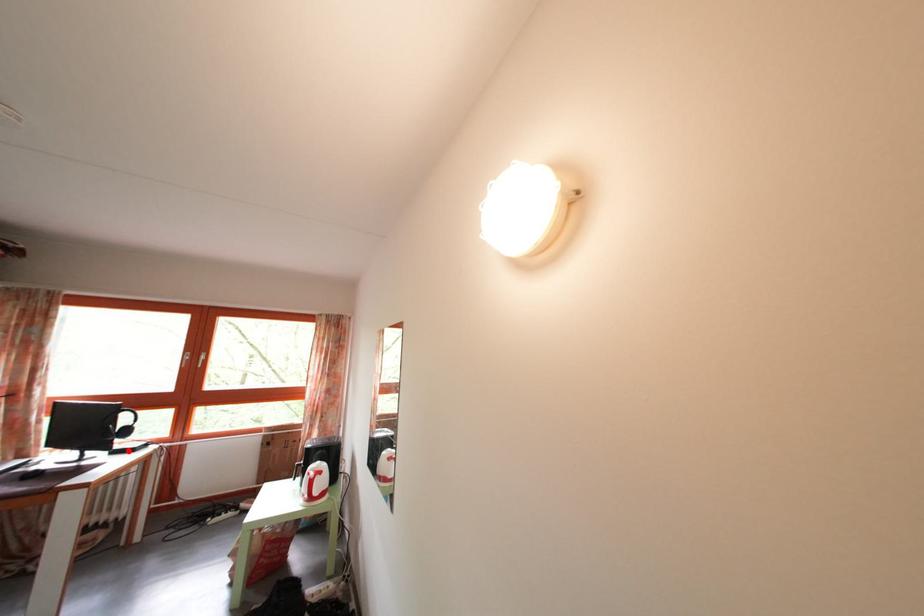
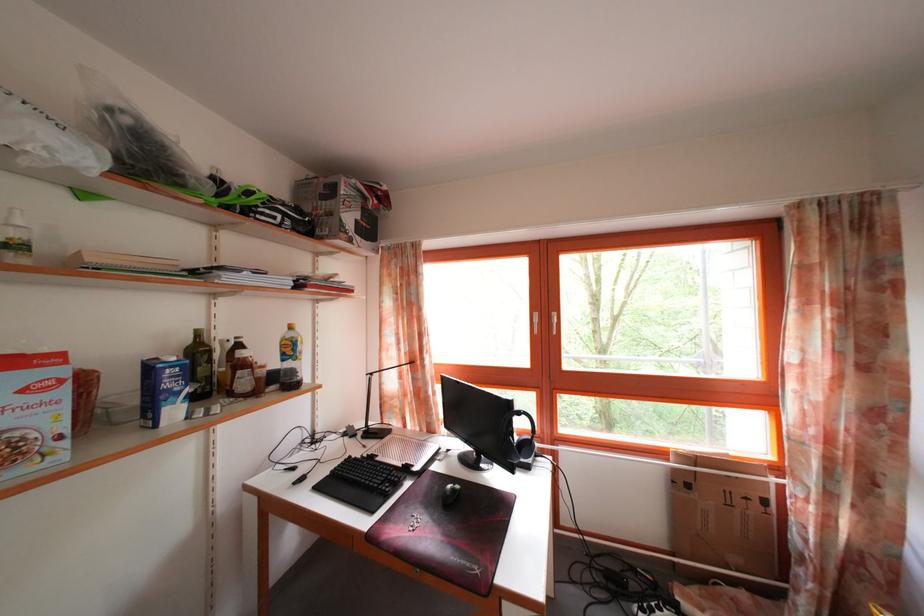
Question: I am providing you with two images of the same scene from different viewpoints. A red point is marked on the first image. Is the red point's position out of view in image 2?

Choices:
 (A) Yes
 (B) No

Answer: (B)